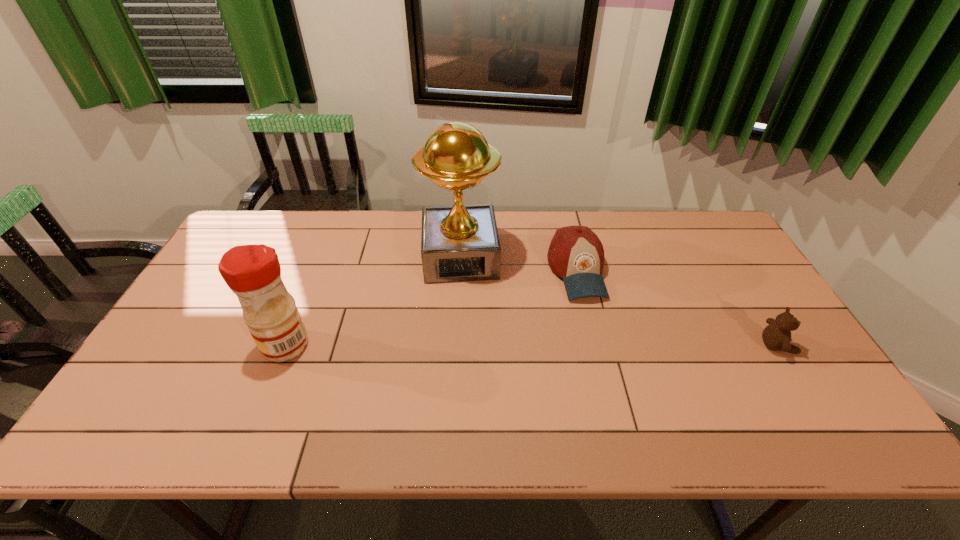
The height and width of the screenshot is (540, 960). Find the location of `free region located 0.090m on the front-facing side of the second object from right to left`. free region located 0.090m on the front-facing side of the second object from right to left is located at coordinates (595, 328).

At what (x,y) coordinates should I click in order to perform the action: click on free space located 0.320m on the front-facing side of the second object from right to left. Please return your answer as a coordinate pair (x, y). Image resolution: width=960 pixels, height=540 pixels. Looking at the image, I should click on (623, 402).

Find the location of a particular element. The image size is (960, 540). free space located 0.050m on the front-facing side of the second object from right to left is located at coordinates (591, 316).

This screenshot has width=960, height=540. I want to click on award that is positioned at the far edge, so click(x=459, y=243).

Where is `baseball cap located in the far edge section of the desktop`? baseball cap located in the far edge section of the desktop is located at coordinates (576, 254).

This screenshot has height=540, width=960. What are the coordinates of `object at the right edge` in the screenshot? It's located at (777, 335).

Locate an element on the screen. blank area at the far edge is located at coordinates (346, 221).

Find the location of a particular element. free region at the near edge is located at coordinates (610, 403).

Where is `free location at the left edge of the desktop`? free location at the left edge of the desktop is located at coordinates (214, 280).

You are a GUI agent. You are given a task and a screenshot of the screen. Output one action in this format:
    pyautogui.click(x=<x>, y=<y>)
    Task: Click on the vacant region at the right edge
    This screenshot has width=960, height=540.
    Given the screenshot: What is the action you would take?
    pyautogui.click(x=707, y=284)